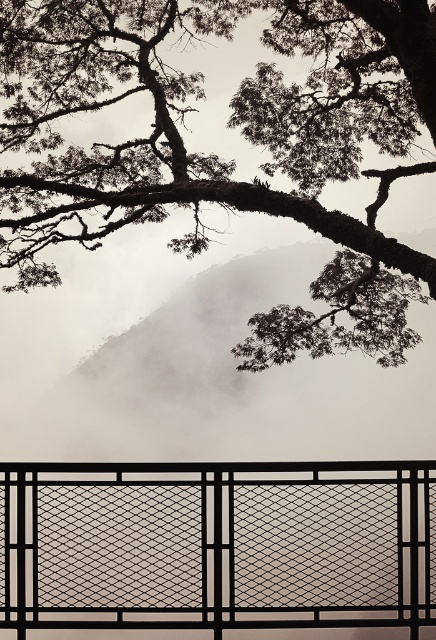
You are standing on a balcony and see the dark bark tree at upper center and the black mesh fence at lower center. Which object is closer to your eye level?

The black mesh fence at lower center is closer to your eye level because it is positioned below the dark bark tree at upper center, which is above it.

You are standing on a viewing platform with a black metal railing in front of you. You want to take a photo of the dark bark tree at upper center. Where should you aim your camera relative to the railing?

The dark bark tree at upper center is located at point 0.244 on the horizontal axis and 0.498 on the vertical axis relative to the railing. To capture it in your photo, aim your camera slightly to the left and above the center of the railing.